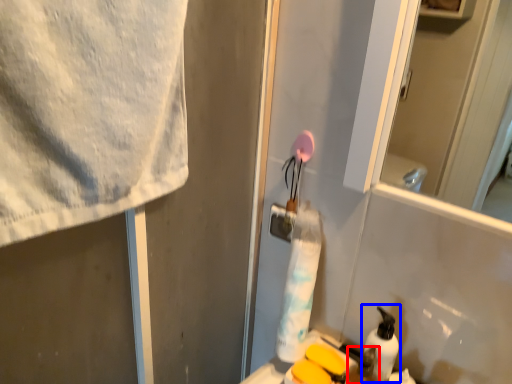
Question: Which of the following is the closest to the observer, toiletry (highlighted by a red box) or cleaning product (highlighted by a blue box)?

Choices:
 (A) toiletry
 (B) cleaning product

Answer: (A)